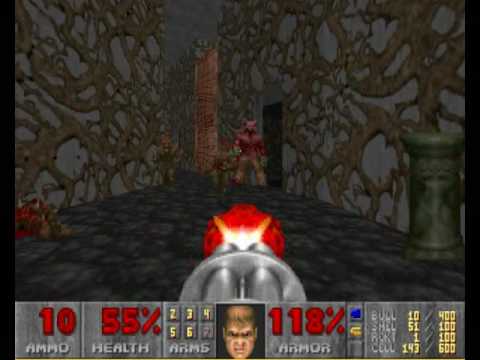
What are the coordinates of `stone flooring` in the screenshot? It's located at click(x=101, y=246).